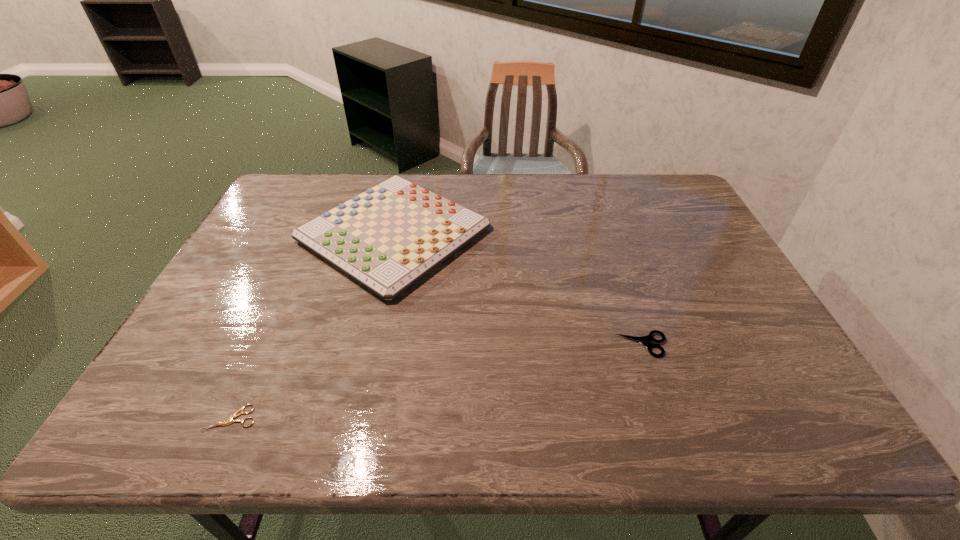
Locate an element on the screen. object present at the near edge is located at coordinates (235, 415).

Locate an element on the screen. gameboard positioned at the left edge is located at coordinates (386, 238).

This screenshot has width=960, height=540. Find the location of `shears situated at the left edge`. shears situated at the left edge is located at coordinates (235, 415).

At what (x,y) coordinates should I click in order to perform the action: click on object located in the far left corner section of the desktop. Please return your answer as a coordinate pair (x, y). Looking at the image, I should click on (386, 238).

Locate an element on the screen. This screenshot has width=960, height=540. object located at the near left corner is located at coordinates (235, 415).

You are a GUI agent. You are given a task and a screenshot of the screen. Output one action in this format:
    pyautogui.click(x=<x>, y=<y>)
    Task: Click on the free spot at the far edge of the desktop
    
    Given the screenshot: What is the action you would take?
    pyautogui.click(x=518, y=183)

In the image, there is a desktop. What are the coordinates of `vacant space at the near edge` in the screenshot? It's located at (451, 427).

Locate an element on the screen. free space at the left edge is located at coordinates (242, 244).

In the image, there is a desktop. Identify the location of vacant space at the right edge. (744, 290).

Identify the location of vacant space in between the nearer shears and the rightmost object. (437, 381).